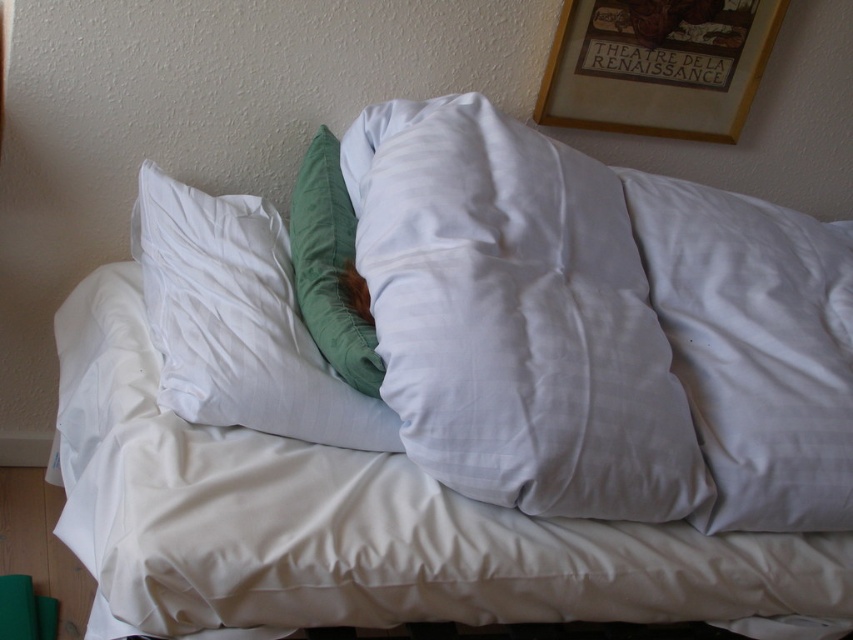
You are arranging flowers in a vase placed on a table near the bed. You want to place the flowers so they are between the wooden picture frame at upper center and the velvety green pillow at center. Is this possible?

The wooden picture frame at upper center is further to the viewer than the velvety green pillow at center, so placing flowers between them would require positioning the flowers closer to the frame since the pillow is behind it.

You are arranging flowers in a vase that is placed on a table near the bed. You want to ensure the flowers are visible from the wooden picture frame at upper center and the velvety green pillow at center. Which object will have a wider view of the flowers?

The wooden picture frame at upper center has a wider view of the flowers because its width surpasses that of the velvety green pillow at center.

You have a small decorative item that is 12 inches wide. You want to place it on either the white smooth pillow at right or the velvety green pillow at center. Which pillow can fit the item without it hanging off the edges?

The white smooth pillow at right might be wider than the velvety green pillow at center, so the decorative item would fit better on the white smooth pillow at right.